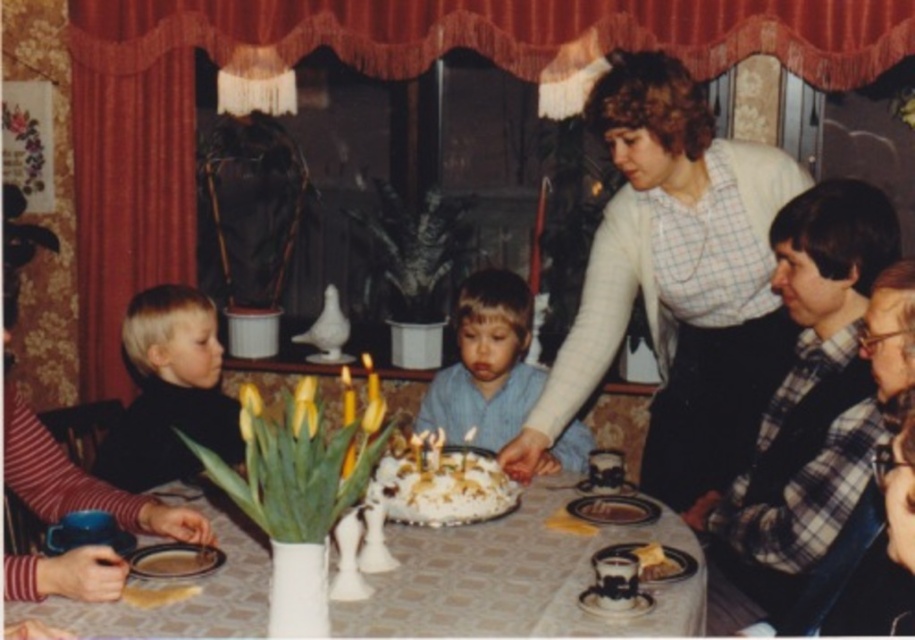
You are a guest at the birthday celebration and want to blow out the candles on the cake. You notice two points on the table. One is at coordinates point (x=490, y=390) and the other is at point (x=611, y=506). Which point is closer to you?

Point (x=490, y=390) is closer to you because it is further to the viewer than point (x=611, y=506).

You are a guest at the birthday celebration and want to place a small gift on the table. Considering the white textured tablecloth at center and the smooth chocolate cake at center, which surface has more space available for placing the gift?

The white textured tablecloth at center has more space available since its width is larger than the smooth chocolate cake at center.